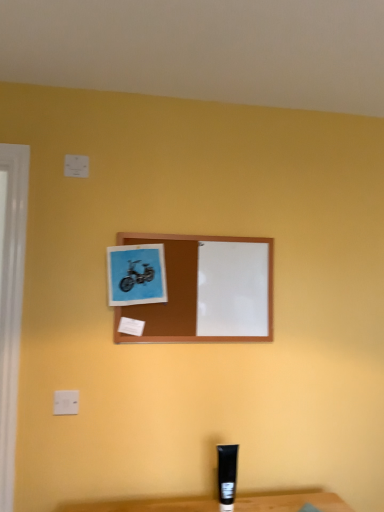
Question: Is brown wooden picture frame at center, which is the 2th picture frame in left-to-right order, aimed at white plastic electric outlet at upper left?

Choices:
 (A) yes
 (B) no

Answer: (B)

Question: From the image's perspective, is brown wooden picture frame at center, which is the 2th picture frame in left-to-right order, on white plastic electric outlet at upper left?

Choices:
 (A) yes
 (B) no

Answer: (A)

Question: From a real-world perspective, is brown wooden picture frame at center, which is the 2th picture frame in left-to-right order, beneath white plastic electric outlet at upper left?

Choices:
 (A) yes
 (B) no

Answer: (B)

Question: Is brown wooden picture frame at center, acting as the first picture frame starting from the right, far away from white plastic electric outlet at upper left?

Choices:
 (A) no
 (B) yes

Answer: (A)

Question: Can we say brown wooden picture frame at center, acting as the first picture frame starting from the right, lies outside white plastic electric outlet at upper left?

Choices:
 (A) no
 (B) yes

Answer: (B)

Question: From their relative heights in the image, would you say white plastic electric outlet at upper left is taller or shorter than blue paper at upper center, which appears as the 2th picture frame when viewed from the right?

Choices:
 (A) tall
 (B) short

Answer: (B)

Question: Do you think white plastic electric outlet at upper left is within blue paper at upper center, arranged as the first picture frame when viewed from the left, or outside of it?

Choices:
 (A) outside
 (B) inside

Answer: (A)

Question: Is point pyautogui.click(x=59, y=406) positioned closer to the camera than point pyautogui.click(x=145, y=293)?

Choices:
 (A) farther
 (B) closer

Answer: (B)

Question: Is white plastic electric outlet at upper left wider or thinner than blue paper at upper center, arranged as the first picture frame when viewed from the left?

Choices:
 (A) thin
 (B) wide

Answer: (A)

Question: From the image's perspective, is blue paper at upper center, which appears as the 2th picture frame when viewed from the right, positioned above or below white plastic electric outlet at upper left?

Choices:
 (A) above
 (B) below

Answer: (A)

Question: From a real-world perspective, relative to white plastic electric outlet at upper left, is blue paper at upper center, arranged as the first picture frame when viewed from the left, vertically above or below?

Choices:
 (A) below
 (B) above

Answer: (B)

Question: Considering their positions, is blue paper at upper center, which appears as the 2th picture frame when viewed from the right, located in front of or behind white plastic electric outlet at upper left?

Choices:
 (A) front
 (B) behind

Answer: (B)

Question: Is blue paper at upper center, which appears as the 2th picture frame when viewed from the right, spatially inside white plastic electric outlet at upper left, or outside of it?

Choices:
 (A) outside
 (B) inside

Answer: (A)

Question: From the image's perspective, is blue paper at upper center, which appears as the 2th picture frame when viewed from the right, located above or below brown wooden picture frame at center, which is the 2th picture frame in left-to-right order?

Choices:
 (A) below
 (B) above

Answer: (B)

Question: In terms of size, does blue paper at upper center, which appears as the 2th picture frame when viewed from the right, appear bigger or smaller than brown wooden picture frame at center, which is the 2th picture frame in left-to-right order?

Choices:
 (A) small
 (B) big

Answer: (A)